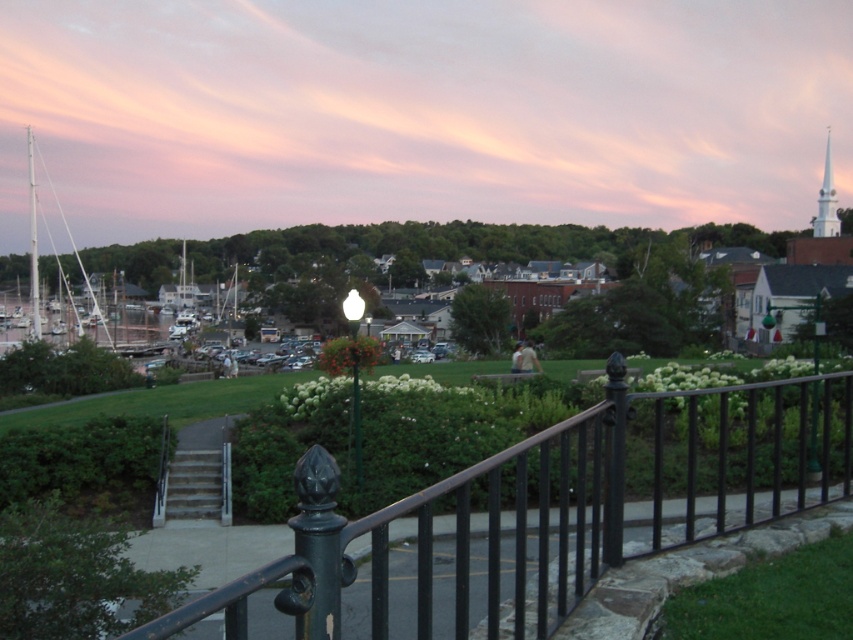
Question: Which object is positioned farthest from the white matte sailboat at left?

Choices:
 (A) pink sky at upper center
 (B) gray concrete stairs at lower left
 (C) white smooth steeple at upper right
 (D) black metal fence at center

Answer: (C)

Question: Is black metal fence at center to the right of white smooth steeple at upper right from the viewer's perspective?

Choices:
 (A) yes
 (B) no

Answer: (B)

Question: Does gray concrete stairs at lower left have a larger size compared to white matte sailboat at left?

Choices:
 (A) no
 (B) yes

Answer: (A)

Question: Which of these objects is positioned farthest from the white matte sailboat at left?

Choices:
 (A) black metal fence at center
 (B) gray concrete stairs at lower left
 (C) white smooth steeple at upper right

Answer: (C)

Question: Which point appears farthest from the camera in this image?

Choices:
 (A) (416, 172)
 (B) (155, 518)

Answer: (A)

Question: Is pink sky at upper center positioned in front of black metal fence at center?

Choices:
 (A) yes
 (B) no

Answer: (B)